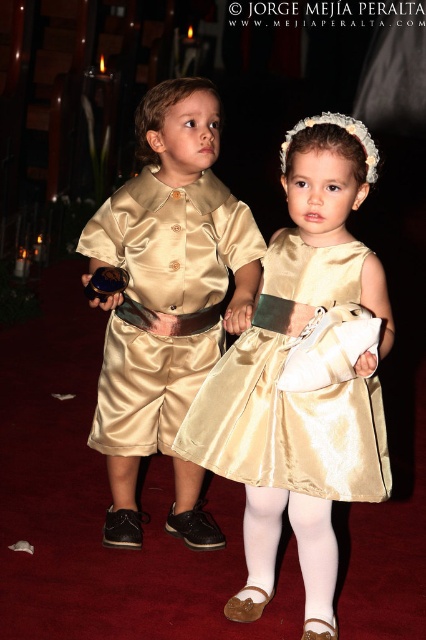
Question: Which of the following is the farthest from the observer?

Choices:
 (A) gold satin dress at center
 (B) gold satin outfit at center

Answer: (A)

Question: Is gold satin dress at center bigger than white satin tights at lower center?

Choices:
 (A) no
 (B) yes

Answer: (B)

Question: Does gold satin outfit at center appear on the right side of white satin tights at lower center?

Choices:
 (A) no
 (B) yes

Answer: (A)

Question: Which object is farther from the camera taking this photo?

Choices:
 (A) white satin tights at lower center
 (B) gold satin dress at center

Answer: (A)

Question: Which is farther from the gold satin outfit at center?

Choices:
 (A) gold satin dress at center
 (B) white satin tights at lower center

Answer: (B)

Question: Does gold satin dress at center have a lesser width compared to white satin tights at lower center?

Choices:
 (A) no
 (B) yes

Answer: (A)